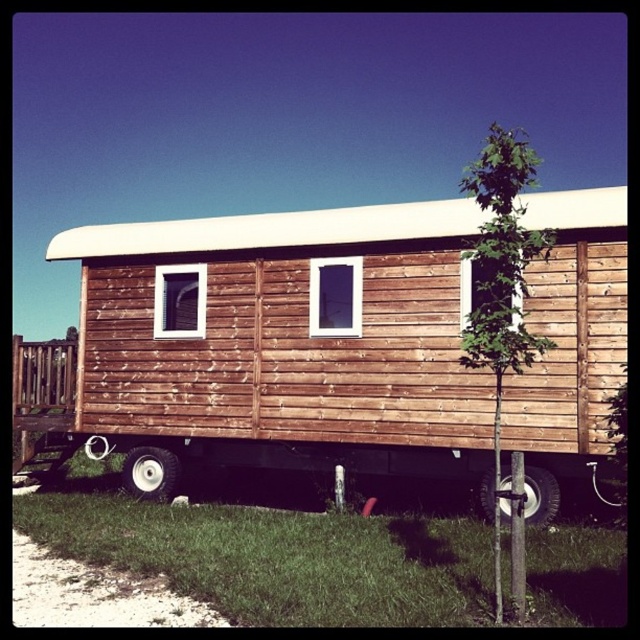
Consider the image. Does brown wooden train car at center lie in front of rubber/textured wheel at lower left?

Yes, brown wooden train car at center is closer to the viewer.

Does brown wooden train car at center have a greater height compared to rubber/textured wheel at lower left?

Yes.

Is point (45, 444) behind point (134, 458)?

Yes, point (45, 444) is behind point (134, 458).

I want to click on brown wooden train car at center, so click(x=269, y=342).

Describe the element at coordinates (269, 342) in the screenshot. I see `brown wooden train car at center` at that location.

Is brown wooden train car at center to the left of black rubber tire at lower center from the viewer's perspective?

Indeed, brown wooden train car at center is positioned on the left side of black rubber tire at lower center.

Between point (420, 435) and point (532, 488), which one is positioned in front?

Point (532, 488) is more forward.

This screenshot has width=640, height=640. Find the location of `brown wooden train car at center`. brown wooden train car at center is located at coordinates (269, 342).

What do you see at coordinates (540, 496) in the screenshot? This screenshot has height=640, width=640. I see `black rubber tire at lower center` at bounding box center [540, 496].

Can you confirm if black rubber tire at lower center is positioned to the left of rubber/textured wheel at lower left?

In fact, black rubber tire at lower center is to the right of rubber/textured wheel at lower left.

The image size is (640, 640). Describe the element at coordinates (540, 496) in the screenshot. I see `black rubber tire at lower center` at that location.

Where is `black rubber tire at lower center`? black rubber tire at lower center is located at coordinates (540, 496).